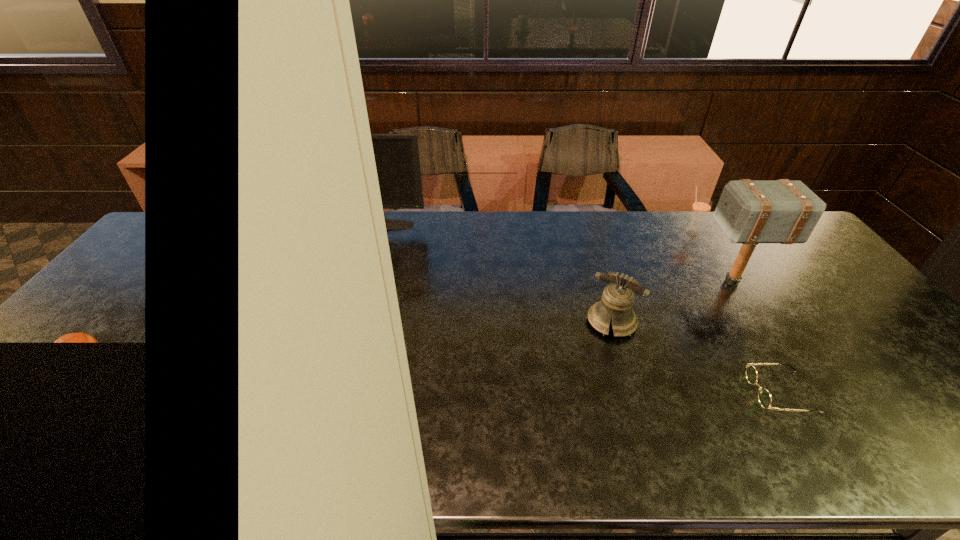
The image size is (960, 540). I want to click on the leftmost object, so click(397, 159).

The height and width of the screenshot is (540, 960). Identify the location of mallet. (749, 212).

Identify the location of straw. This screenshot has width=960, height=540. (701, 207).

At what (x,y) coordinates should I click in order to perform the action: click on the fourth object from right to left. Please return your answer as a coordinate pair (x, y). The width and height of the screenshot is (960, 540). Looking at the image, I should click on (617, 300).

You are a GUI agent. You are given a task and a screenshot of the screen. Output one action in this format:
    pyautogui.click(x=<x>, y=<y>)
    Task: Click on the bell
    The image size is (960, 540).
    Given the screenshot: What is the action you would take?
    pyautogui.click(x=617, y=300)

This screenshot has height=540, width=960. Identify the location of the nearest object. (x=764, y=397).

Where is `the shortest object`? This screenshot has width=960, height=540. the shortest object is located at coordinates (764, 397).

I want to click on vacant region located 0.070m on the front-facing side of the monitor, so click(358, 241).

The width and height of the screenshot is (960, 540). I want to click on blank area located 0.060m on the striking surface of the third farthest object, so click(x=678, y=282).

Where is `vacant space located on the striking surface of the third farthest object`? The image size is (960, 540). vacant space located on the striking surface of the third farthest object is located at coordinates (611, 282).